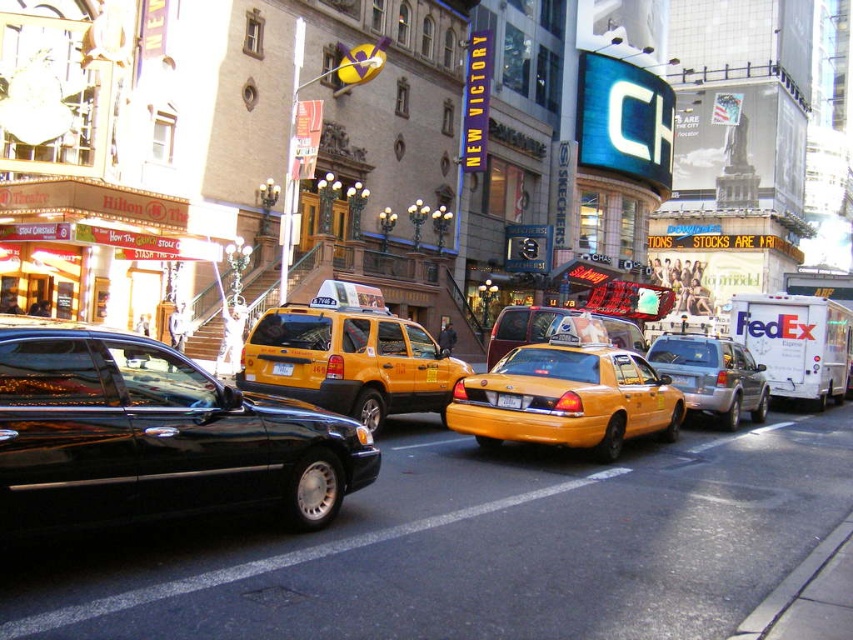
Does yellow matte taxi at center appear on the left side of silver metallic suv at center?

Correct, you'll find yellow matte taxi at center to the left of silver metallic suv at center.

I want to click on yellow matte taxi at center, so click(567, 394).

Can you confirm if yellow matte taxi at center is positioned above yellow rubber taxi cab at center?

No.

Who is more forward, (608, 454) or (604, 326)?

Positioned in front is point (608, 454).

Which is in front, point (621, 400) or point (618, 323)?

Point (621, 400) is more forward.

Locate an element on the screen. The height and width of the screenshot is (640, 853). yellow matte taxi at center is located at coordinates 567,394.

Does yellow matte taxi at center have a greater height compared to yellow plastic taxi at center?

Yes, yellow matte taxi at center is taller than yellow plastic taxi at center.

Who is positioned more to the right, yellow matte taxi at center or yellow plastic taxi at center?

From the viewer's perspective, yellow matte taxi at center appears more on the right side.

This screenshot has height=640, width=853. Find the location of `yellow matte taxi at center`. yellow matte taxi at center is located at coordinates (567, 394).

At what (x,y) coordinates should I click in order to perform the action: click on yellow matte taxi at center. Please return your answer as a coordinate pair (x, y). The image size is (853, 640). Looking at the image, I should click on (567, 394).